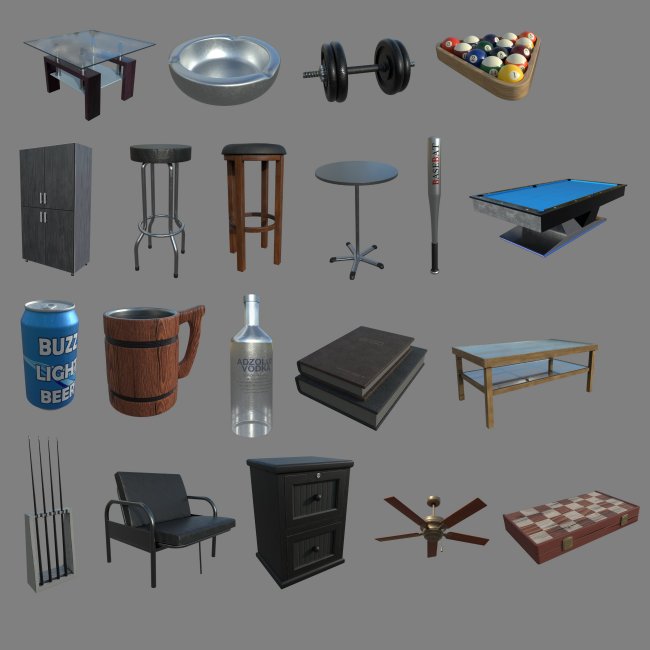
Find the location of a particular element. This screenshot has width=650, height=650. tables is located at coordinates (351, 171), (92, 51), (500, 344), (533, 198).